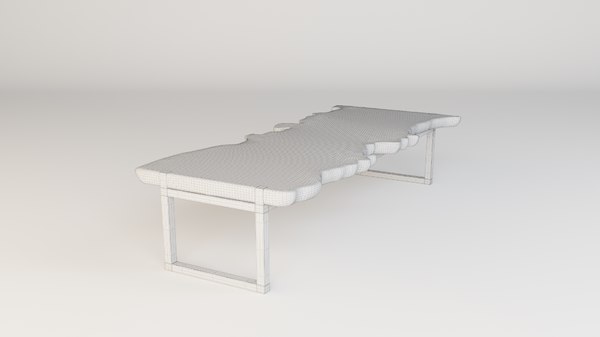
This screenshot has height=337, width=600. I want to click on top surface, so click(x=318, y=138).